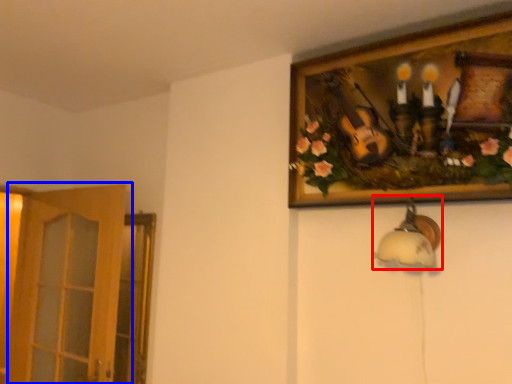
Question: Which point is closer to the camera, lamp (highlighted by a red box) or door (highlighted by a blue box)?

Choices:
 (A) lamp
 (B) door

Answer: (A)